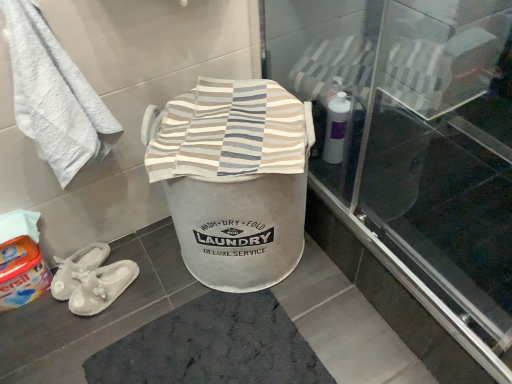
Question: Does transparent glass screen door at upper center lie behind white soft towel at upper left?

Choices:
 (A) yes
 (B) no

Answer: (B)

Question: Would you say white soft towel at upper left is part of transparent glass screen door at upper center's contents?

Choices:
 (A) no
 (B) yes

Answer: (A)

Question: From a real-world perspective, is transparent glass screen door at upper center beneath white soft towel at upper left?

Choices:
 (A) yes
 (B) no

Answer: (A)

Question: Can you confirm if transparent glass screen door at upper center is positioned to the right of white soft towel at upper left?

Choices:
 (A) no
 (B) yes

Answer: (B)

Question: Is transparent glass screen door at upper center directly adjacent to white soft towel at upper left?

Choices:
 (A) yes
 (B) no

Answer: (B)

Question: Is transparent glass screen door at upper center at the left side of white soft towel at upper left?

Choices:
 (A) yes
 (B) no

Answer: (B)

Question: Is orange fabric detergent at lower left closer to the viewer compared to white fabric laundry basket at center?

Choices:
 (A) yes
 (B) no

Answer: (B)

Question: Is orange fabric detergent at lower left outside white fabric laundry basket at center?

Choices:
 (A) no
 (B) yes

Answer: (B)

Question: Considering the relative sizes of orange fabric detergent at lower left and white fabric laundry basket at center in the image provided, is orange fabric detergent at lower left shorter than white fabric laundry basket at center?

Choices:
 (A) no
 (B) yes

Answer: (B)

Question: Considering the relative sizes of orange fabric detergent at lower left and white fabric laundry basket at center in the image provided, is orange fabric detergent at lower left bigger than white fabric laundry basket at center?

Choices:
 (A) yes
 (B) no

Answer: (B)

Question: Is orange fabric detergent at lower left at the right side of white fabric laundry basket at center?

Choices:
 (A) no
 (B) yes

Answer: (A)

Question: From a real-world perspective, is orange fabric detergent at lower left over white fabric laundry basket at center?

Choices:
 (A) yes
 (B) no

Answer: (B)

Question: Is white soft towel at upper left bigger than orange fabric detergent at lower left?

Choices:
 (A) no
 (B) yes

Answer: (B)